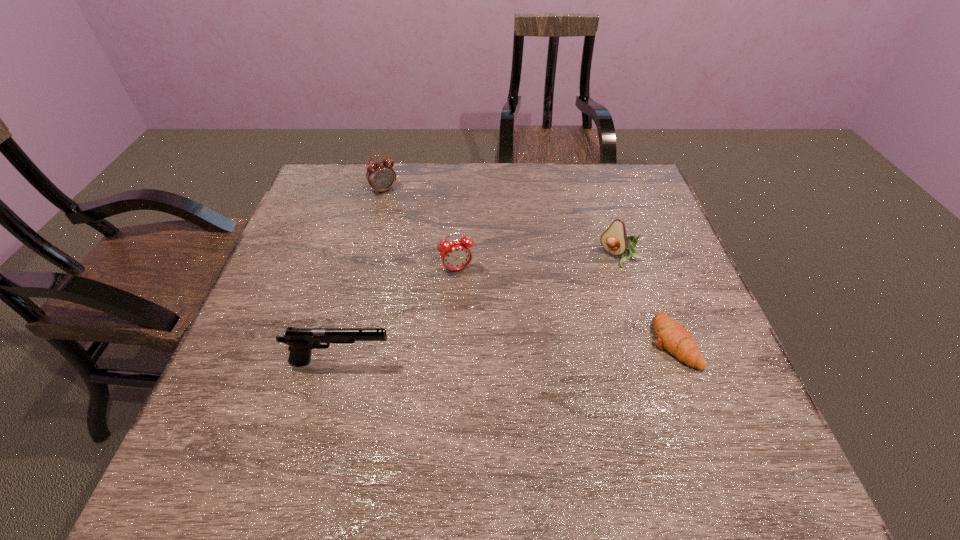
In order to click on crescent roll at the right edge in this screenshot , I will do `click(673, 337)`.

Where is `avocado that is at the right edge`? avocado that is at the right edge is located at coordinates (614, 240).

The height and width of the screenshot is (540, 960). I want to click on vacant space at the far edge, so tap(460, 171).

Image resolution: width=960 pixels, height=540 pixels. In the image, there is a desktop. Find the location of `vacant region at the near edge`. vacant region at the near edge is located at coordinates (390, 420).

The height and width of the screenshot is (540, 960). Find the location of `free space at the left edge of the desktop`. free space at the left edge of the desktop is located at coordinates pos(268,351).

At what (x,y) coordinates should I click in order to perform the action: click on free region at the right edge. Please return your answer as a coordinate pair (x, y). Image resolution: width=960 pixels, height=540 pixels. Looking at the image, I should click on (662, 274).

Image resolution: width=960 pixels, height=540 pixels. In the image, there is a desktop. Identify the location of vacant space at the far left corner. (357, 206).

Identify the location of vacant space at the far right corner of the desktop. This screenshot has width=960, height=540. (x=644, y=178).

At what (x,y) coordinates should I click in order to perform the action: click on free space between the avocado and the nearer alarm clock. Please return your answer as a coordinate pair (x, y). The width and height of the screenshot is (960, 540). Looking at the image, I should click on (539, 264).

Identify the location of free spot between the farthest object and the gun. The height and width of the screenshot is (540, 960). (362, 276).